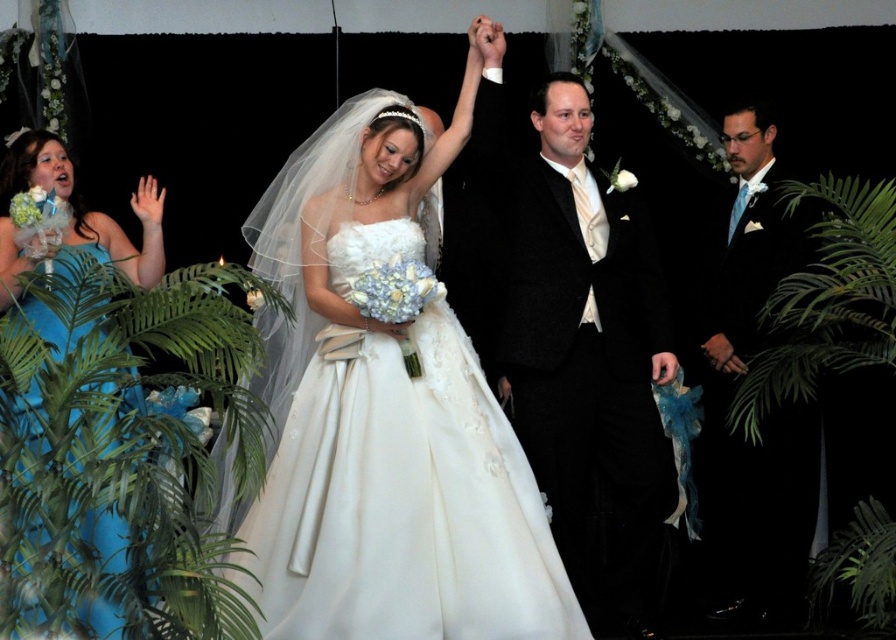
Question: Which object is farther from the camera taking this photo?

Choices:
 (A) teal satin dress at left
 (B) satin/smooth dress at center
 (C) black textured suit at center

Answer: (C)

Question: Is satin/smooth dress at center thinner than black textured suit at center?

Choices:
 (A) no
 (B) yes

Answer: (A)

Question: Which object is the farthest from the shiny black suit at center?

Choices:
 (A) teal satin dress at left
 (B) black textured suit at center
 (C) satin/smooth dress at center

Answer: (A)

Question: Is satin/smooth dress at center closer to the viewer compared to teal satin dress at left?

Choices:
 (A) no
 (B) yes

Answer: (A)

Question: Which of the following is the farthest from the observer?

Choices:
 (A) teal satin dress at left
 (B) black textured suit at center
 (C) satin/smooth dress at center
 (D) shiny black suit at center

Answer: (D)

Question: Is satin/smooth dress at center smaller than shiny black suit at center?

Choices:
 (A) yes
 (B) no

Answer: (B)